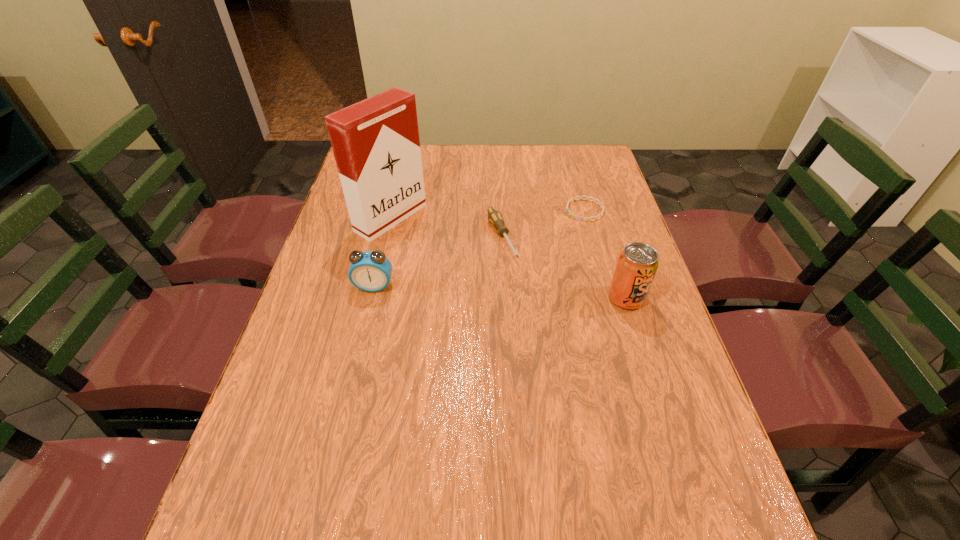
You are a GUI agent. You are given a task and a screenshot of the screen. Output one action in this format:
    pyautogui.click(x=<x>, y=<y>)
    Task: Click on the vacant region between the bracelet and the tallest object
    
    Given the screenshot: What is the action you would take?
    pyautogui.click(x=488, y=214)

You are a GUI agent. You are given a task and a screenshot of the screen. Output one action in this format:
    pyautogui.click(x=<x>, y=<y>)
    Task: Click on the unoccupied area between the third shortest object and the shortest object
    This screenshot has height=540, width=960.
    Given the screenshot: What is the action you would take?
    pyautogui.click(x=479, y=248)

Find the location of a particular element. This screenshot has height=540, width=960. empty space that is in between the third object from left to right and the shortest object is located at coordinates (543, 224).

You are a GUI agent. You are given a task and a screenshot of the screen. Output one action in this format:
    pyautogui.click(x=<x>, y=<y>)
    Task: Click on the free space between the screwdriver and the alarm clock
    
    Given the screenshot: What is the action you would take?
    pyautogui.click(x=438, y=262)

Find the location of a particular element. Image resolution: width=960 pixels, height=540 pixels. vacant area that lies between the screwdriver and the soda can is located at coordinates (564, 268).

Identify the location of object that can be found as the fourth closest to the cigarette_case. (637, 264).

Where is `object that ranks as the second closest to the shortest object`? object that ranks as the second closest to the shortest object is located at coordinates (637, 264).

The image size is (960, 540). Find the location of `free location that satisfies the following two spatial constraints: 1. on the face of the third shortest object; 2. on the right side of the soda can`. free location that satisfies the following two spatial constraints: 1. on the face of the third shortest object; 2. on the right side of the soda can is located at coordinates (372, 298).